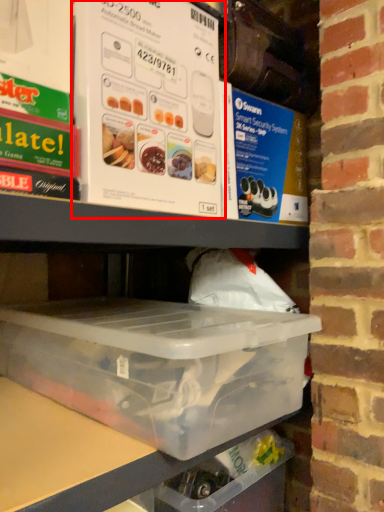
Question: From the image's perspective, where is box (annotated by the red box) located relative to box?

Choices:
 (A) below
 (B) above

Answer: (B)